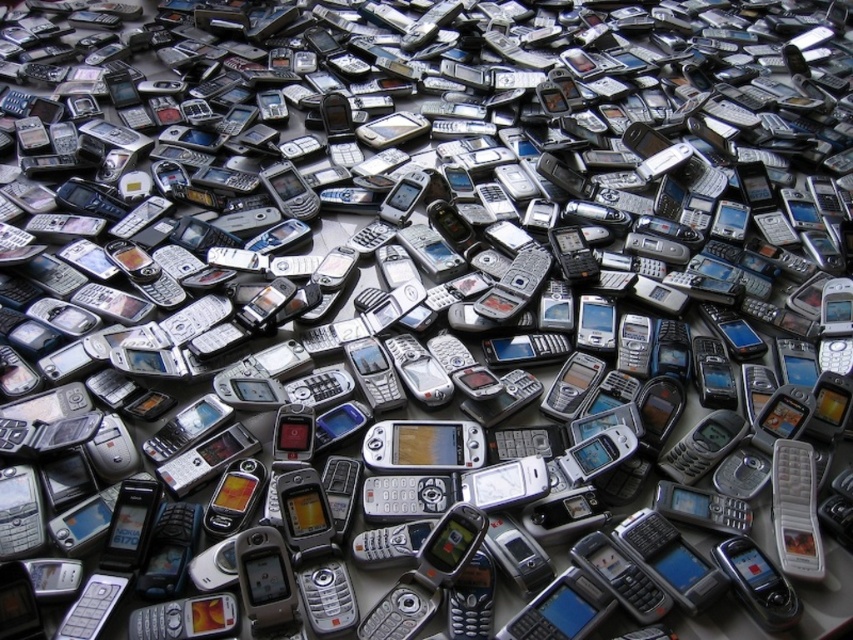
You are standing at the edge of the flat surface where the old mobile phones are scattered. You want to place a new phone exactly at the point marked as point (422, 445). However, there is already a wooden phone at center occupying that location. Can you place your new phone there?

The point (422, 445) is on the wooden phone at center, so you cannot place the new phone there as it is already occupied.

You are standing at the origin point in the center of the room where the mobile phones are displayed. You see two points marked in the image, point (434,436) and point (773,616). Which point is closer to you?

Point (773,616) is closer to you because it is in front of point (434,436) according to their positions.

You are a delivery robot with a 24 inch wide box. You need to place the box between the wooden phone at center and the silver metallic phone at center. Is there enough space to fit the box between them?

The distance between the wooden phone at center and the silver metallic phone at center is 22.93 inches. Since the box is 24 inches wide, it is slightly wider than the available space. Therefore, the box cannot fit between them.